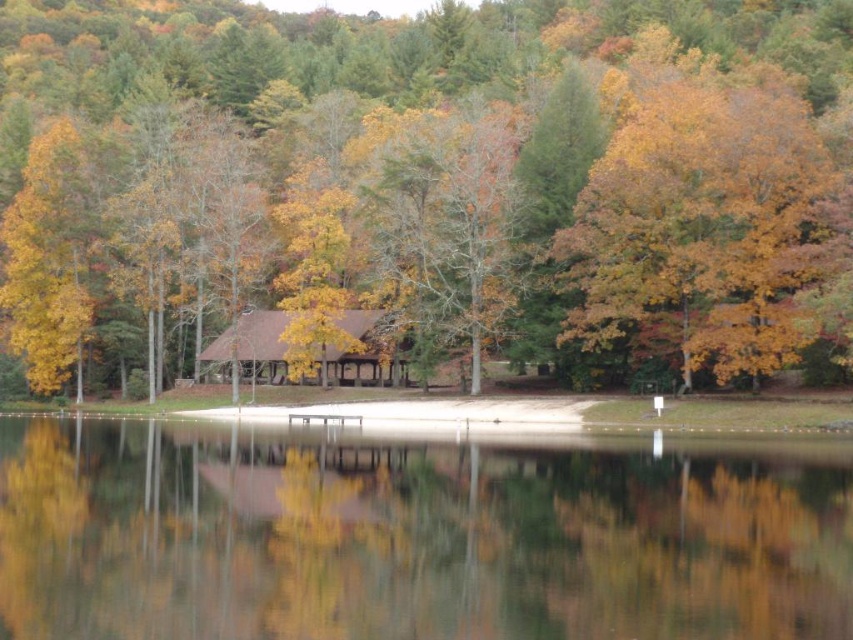
From the picture: Between yellow matte tree at center and golden yellow leaves at upper right, which one appears on the left side from the viewer's perspective?

From the viewer's perspective, yellow matte tree at center appears more on the left side.

Who is more distant from viewer, (486, 241) or (698, 195)?

The point (486, 241) is more distant.

Where is `yellow matte tree at center`? The width and height of the screenshot is (853, 640). yellow matte tree at center is located at coordinates (426, 182).

This screenshot has width=853, height=640. Describe the element at coordinates (410, 538) in the screenshot. I see `transparent glass water at center` at that location.

Who is positioned more to the right, transparent glass water at center or golden yellow leaves at upper right?

golden yellow leaves at upper right

This screenshot has width=853, height=640. I want to click on transparent glass water at center, so click(x=410, y=538).

Who is taller, yellow matte tree at center or transparent glass water at center?

yellow matte tree at center is taller.

Does yellow matte tree at center come behind transparent glass water at center?

Yes.

Locate an element on the screen. This screenshot has width=853, height=640. yellow matte tree at center is located at coordinates (426, 182).